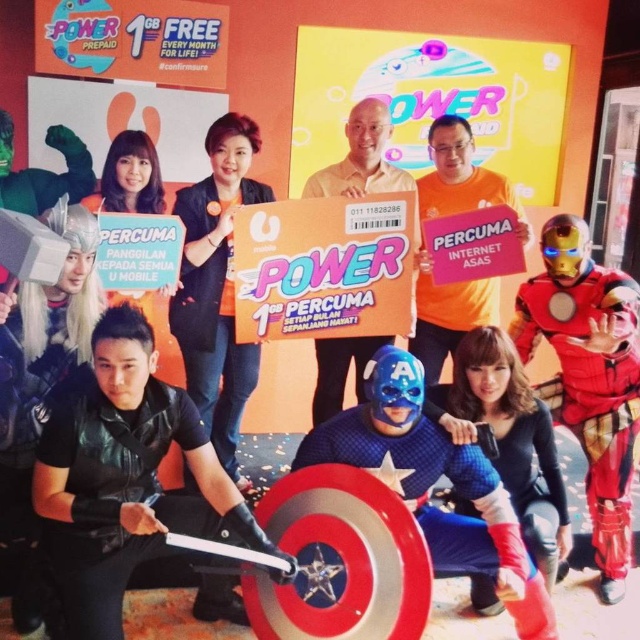
Which is more to the right, shiny metallic iron man at right or matte cardboard box at center?

Positioned to the right is shiny metallic iron man at right.

Is shiny metallic iron man at right smaller than matte cardboard box at center?

Incorrect, shiny metallic iron man at right is not smaller in size than matte cardboard box at center.

The width and height of the screenshot is (640, 640). I want to click on shiny metallic iron man at right, so click(x=589, y=378).

Does black leather gloves at lower center appear on the right side of orange fabric shirt at center?

No, black leather gloves at lower center is not to the right of orange fabric shirt at center.

Is black leather gloves at lower center closer to camera compared to orange fabric shirt at center?

Yes, black leather gloves at lower center is in front of orange fabric shirt at center.

Is point (122, 352) positioned behind point (182, 291)?

No.

The width and height of the screenshot is (640, 640). Find the location of `black leather gloves at lower center`. black leather gloves at lower center is located at coordinates (125, 480).

Can you confirm if blue spandex suit at center is bigger than matte cardboard box at center?

Indeed, blue spandex suit at center has a larger size compared to matte cardboard box at center.

Where is `blue spandex suit at center`? The image size is (640, 640). blue spandex suit at center is located at coordinates (433, 483).